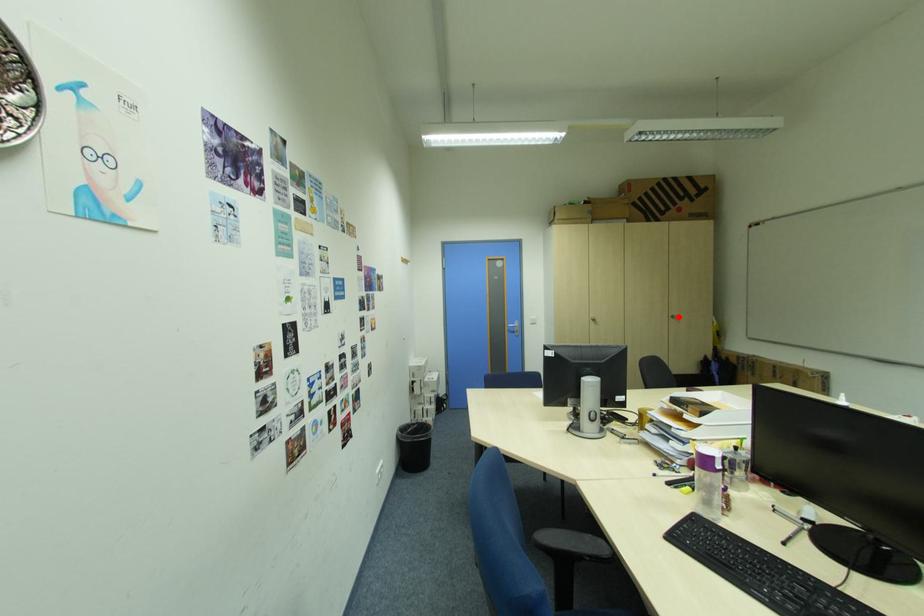
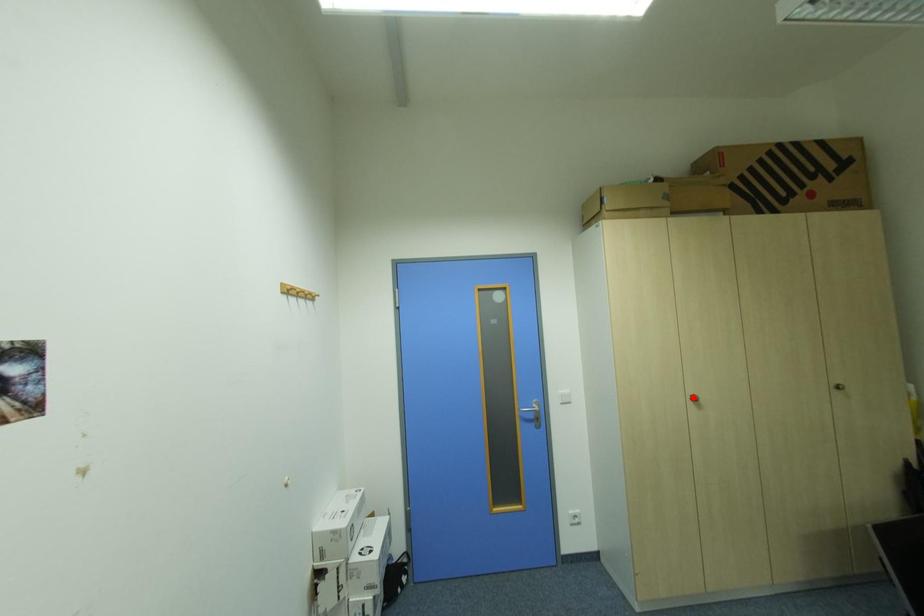
I am providing you with two images of the same scene from different viewpoints. A red point is marked on the first image and another point is marked on the second image. Are the points marked in image1 and image2 representing the same 3D position?

No